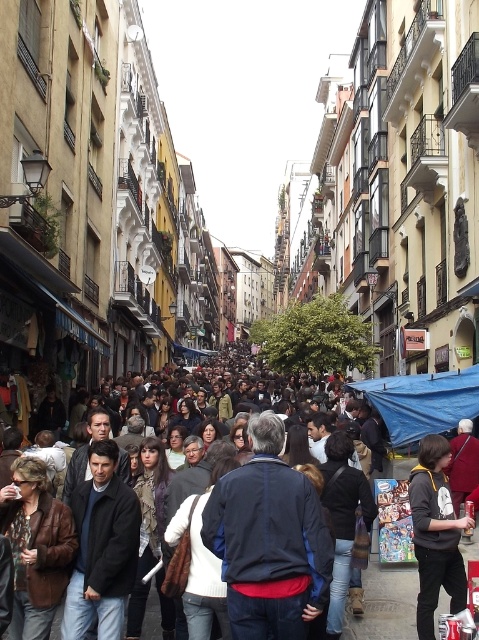
Question: Which point is closer to the camera taking this photo?

Choices:
 (A) (276, 378)
 (B) (441, 428)

Answer: (B)

Question: Which of the following is the closest to the observer?

Choices:
 (A) (426, 403)
 (B) (226, 356)

Answer: (A)

Question: Is blue fabric canopy at center-right below dark gray fabric crowd at center?

Choices:
 (A) yes
 (B) no

Answer: (B)

Question: Which point is closer to the camera?

Choices:
 (A) (457, 372)
 (B) (218, 358)

Answer: (A)

Question: Does blue fabric canopy at center-right appear under dark gray fabric crowd at center?

Choices:
 (A) no
 (B) yes

Answer: (A)

Question: Does blue fabric canopy at center-right have a larger size compared to dark gray fabric crowd at center?

Choices:
 (A) no
 (B) yes

Answer: (A)